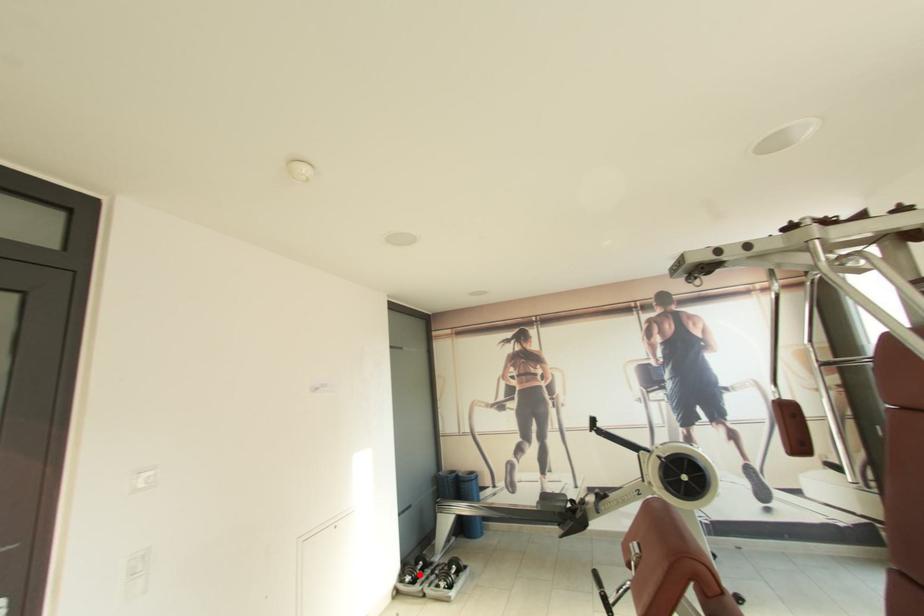
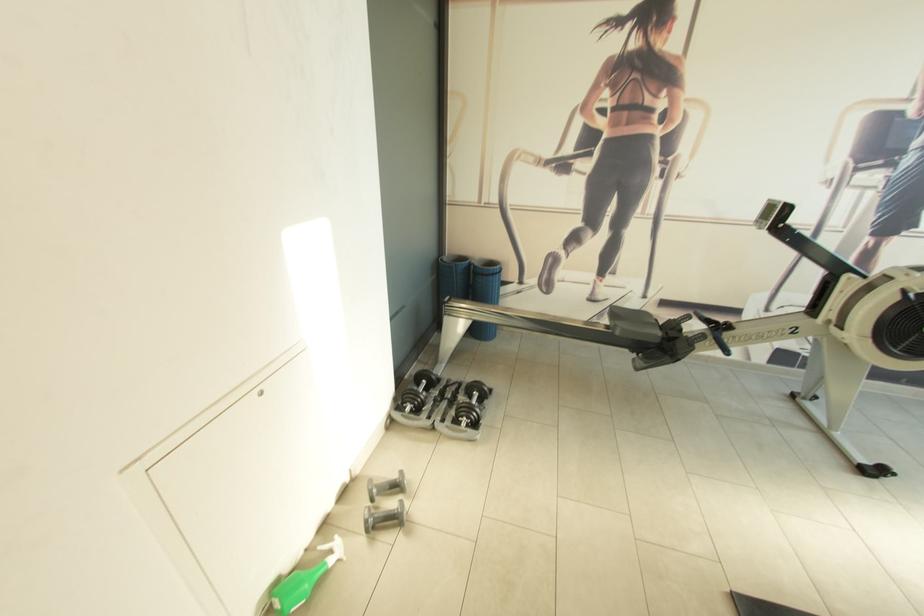
Question: I am providing you with two images of the same scene from different viewpoints. A red point is marked on the first image. At the location where the point appears in image 1, is it still visible in image 2?

Choices:
 (A) Yes
 (B) No

Answer: (A)